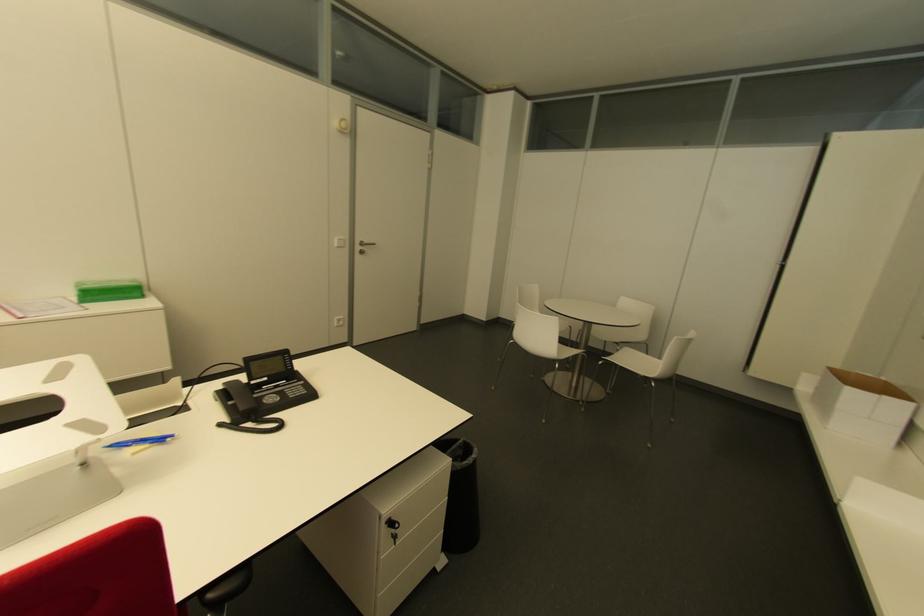
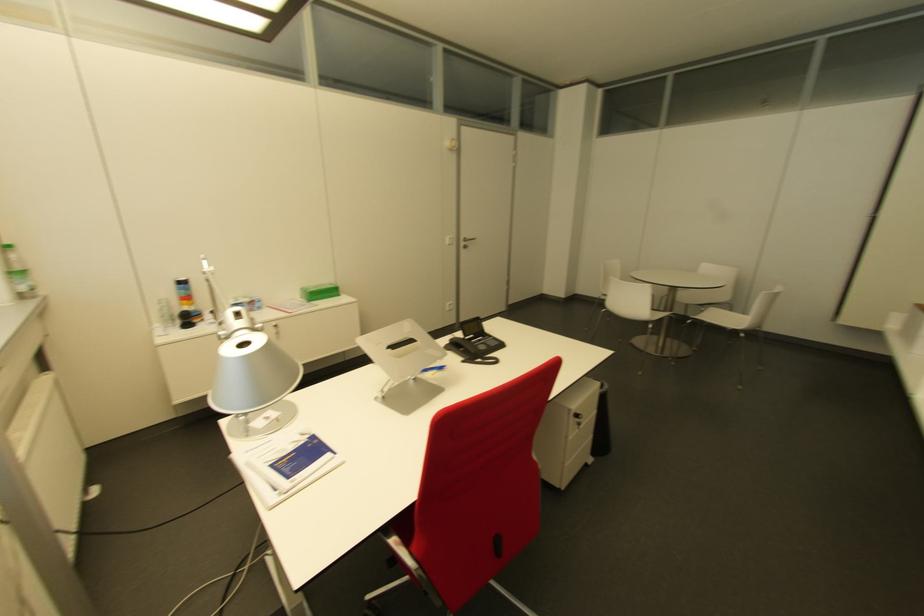
Locate, in the second image, the point that corresponds to pixel 638 336 in the first image.

(722, 298)